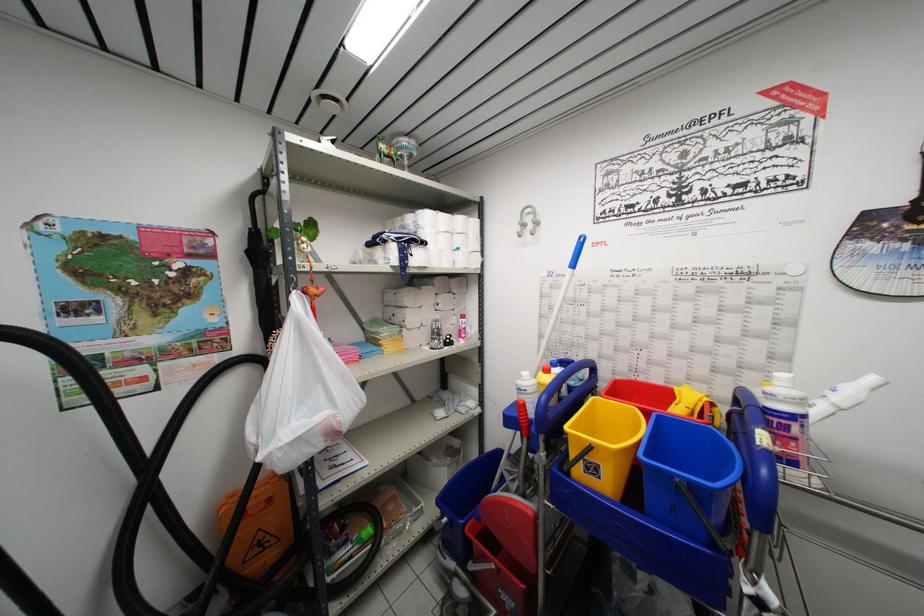
Where would you hang the silver wall hook? Please return your answer as a coordinate pair (x, y).

(528, 221)